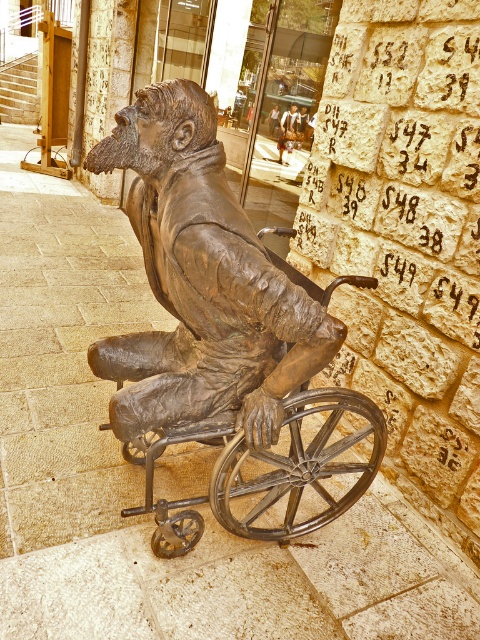
You are a sculptor who wants to move the bronze statue of man at center closer to the bronze metal wheelchair at center so that they are only 2.0 meters apart. Based on the current spacing between them, is this adjustment feasible?

The bronze metal wheelchair at center and bronze statue of man at center are currently 2.70 meters apart. To reduce the distance to 2.0 meters, you would need to move them closer by 0.70 meters. This adjustment is feasible as long as there is sufficient space available in the surrounding area to make this change.

You are standing at point (202, 282) in the image. What object are you directly at?

You are directly at the bronze statue at center located at point (202, 282).